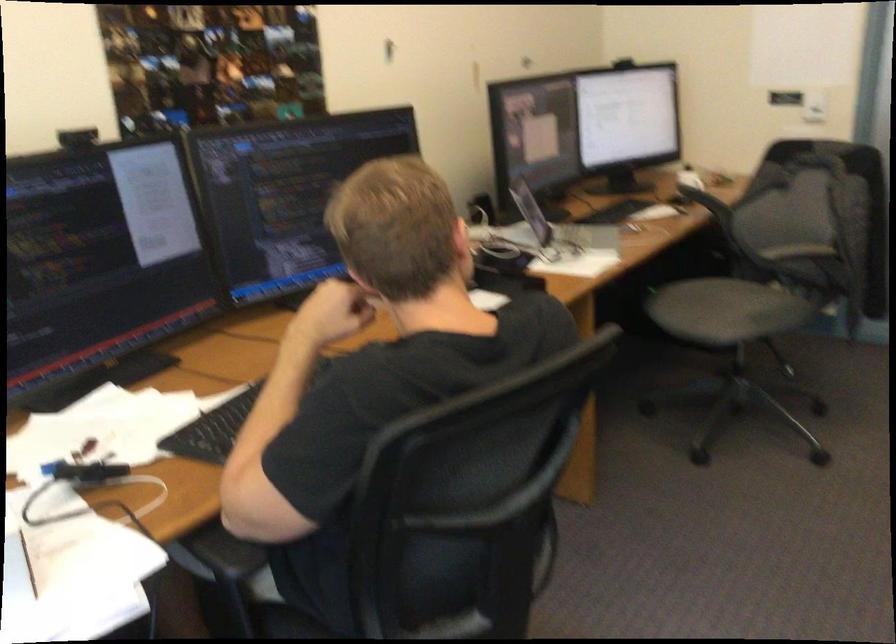
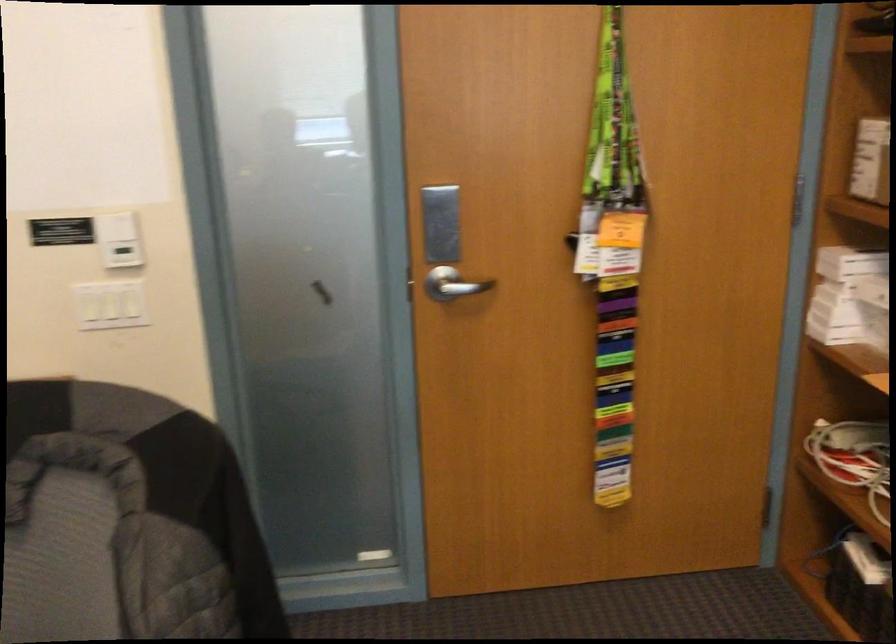
Question: I am providing you with two images of the same scene from different viewpoints. After the viewpoint changes to image2, which objects are now occluded?

Choices:
 (A) lanyard collection
 (B) white light switch
 (C) white box
 (D) none of these

Answer: (D)